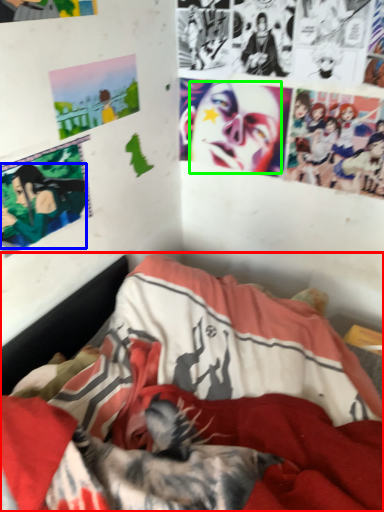
Question: Considering the real-world distances, which object is closest to bed (highlighted by a red box)? person (highlighted by a blue box) or human face (highlighted by a green box).

Choices:
 (A) person
 (B) human face

Answer: (A)